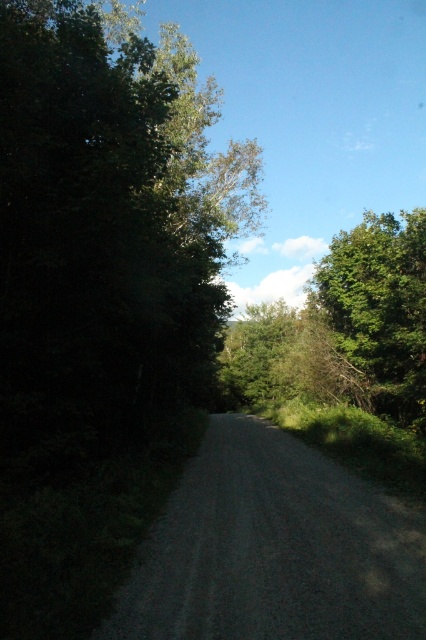
Which is more to the right, gray gravel road at center or green leafy tree at right?

green leafy tree at right

Is point (236, 456) in front of point (385, 369)?

Yes, it is.

The image size is (426, 640). I want to click on gray gravel road at center, so click(273, 548).